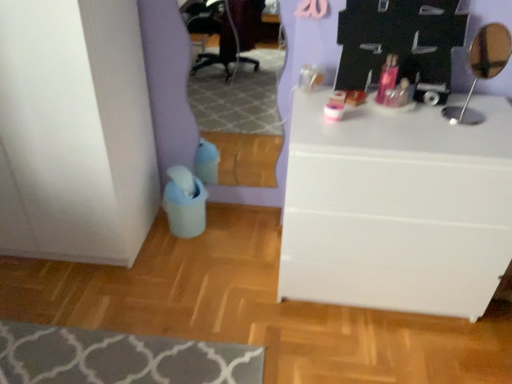
Where is `free space to the right of gray textured rug at lower left`? free space to the right of gray textured rug at lower left is located at coordinates 282,331.